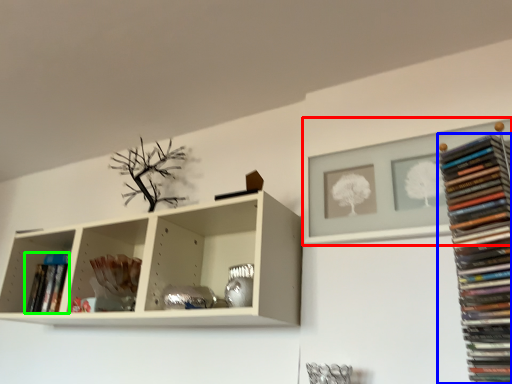
Question: Which object is positioned farthest from shelf (highlighted by a red box)? Select from book (highlighted by a blue box) and book (highlighted by a green box).

Choices:
 (A) book
 (B) book

Answer: (B)